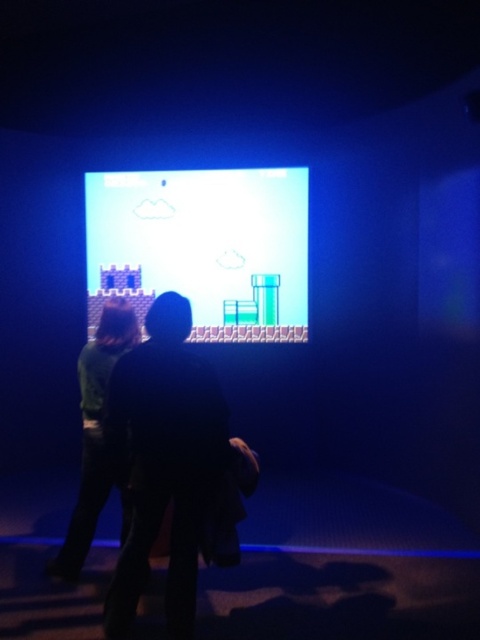
Question: Estimate the real-world distances between objects in this image. Which object is closer to the pixelated video game at center?

Choices:
 (A) green matte shirt at center
 (B) dark fabric jacket at center

Answer: (A)

Question: Does pixelated video game at center appear under dark fabric jacket at center?

Choices:
 (A) no
 (B) yes

Answer: (A)

Question: Which of the following is the farthest from the observer?

Choices:
 (A) dark fabric jacket at center
 (B) green matte shirt at center
 (C) pixelated video game at center

Answer: (C)

Question: In this image, where is pixelated video game at center located relative to green matte shirt at center?

Choices:
 (A) right
 (B) left

Answer: (A)

Question: Where is dark fabric jacket at center located in relation to green matte shirt at center in the image?

Choices:
 (A) left
 (B) right

Answer: (B)

Question: Which object is closer to the camera taking this photo?

Choices:
 (A) green matte shirt at center
 (B) pixelated video game at center

Answer: (A)